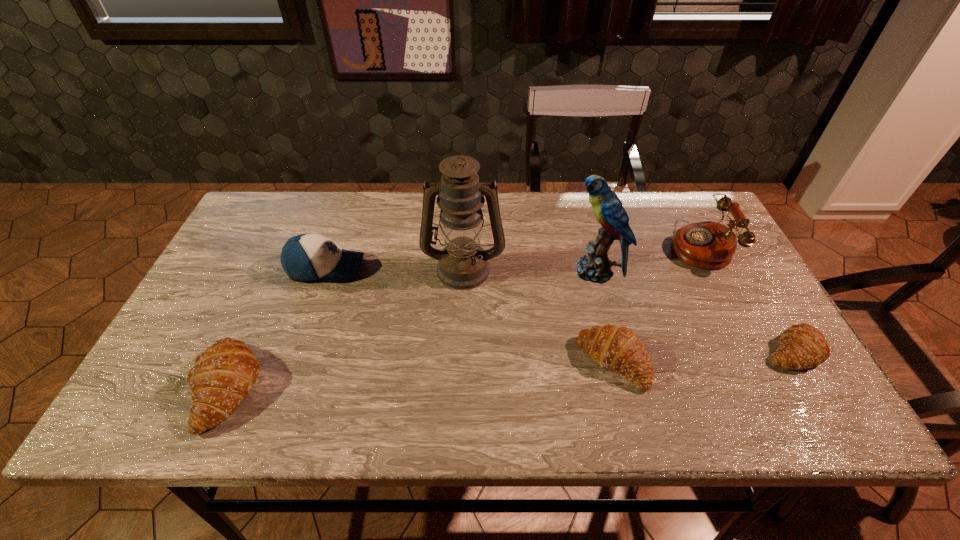
Where is `vacant region located on the left of the second crescent roll from right to left`? The height and width of the screenshot is (540, 960). vacant region located on the left of the second crescent roll from right to left is located at coordinates (551, 362).

Locate an element on the screen. free spot located on the back of the shortest crescent roll is located at coordinates (736, 255).

Image resolution: width=960 pixels, height=540 pixels. Identify the location of vacant space located 0.260m on the face of the sixth shortest object. (474, 272).

Identify the location of free space located on the face of the sixth shortest object. (427, 272).

Image resolution: width=960 pixels, height=540 pixels. I want to click on free location located 0.130m on the face of the sixth shortest object, so click(x=521, y=272).

This screenshot has width=960, height=540. In order to click on vacant space situated on the dial of the telephone in this screenshot , I will do `click(601, 246)`.

Where is `vacant space located 0.340m on the dial of the telephone`? This screenshot has height=540, width=960. vacant space located 0.340m on the dial of the telephone is located at coordinates (x=553, y=246).

Where is `blank space located 0.300m on the dial of the telephone`? Image resolution: width=960 pixels, height=540 pixels. blank space located 0.300m on the dial of the telephone is located at coordinates (567, 246).

The image size is (960, 540). Find the location of `vacant space located 0.390m on the front-facing side of the baseball cap`. vacant space located 0.390m on the front-facing side of the baseball cap is located at coordinates pos(506,268).

Find the location of a particular element. The image size is (960, 540). vacant space located 0.260m on the left of the fifth object from right to left is located at coordinates (329, 268).